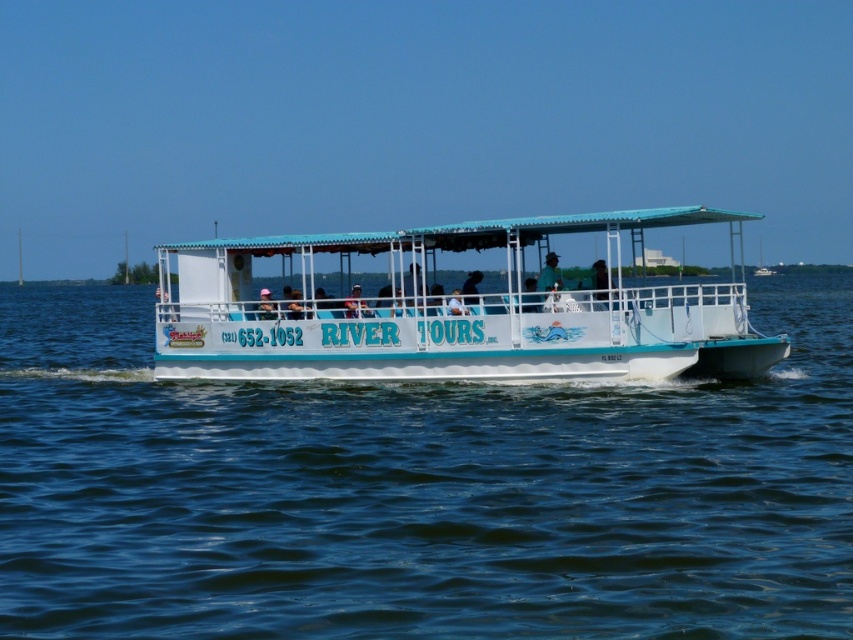
You are a passenger on the white matte boat at center and want to grab the black fabric at center to shade yourself from the sun. Can you reach it without moving from your seat?

The white matte boat at center is closer to the viewer than the black fabric at center, so you cannot reach the black fabric at center from your current position.

You are a passenger on the River Tours boat and want to take a photo of the scenery without any obstructions. You notice both the black fabric at center and the white plastic hat at center are in your view. Which object should you move to ensure the photo is unobstructed?

To take an unobstructed photo, you should move the black fabric at center since it is in front of the white plastic hat at center.